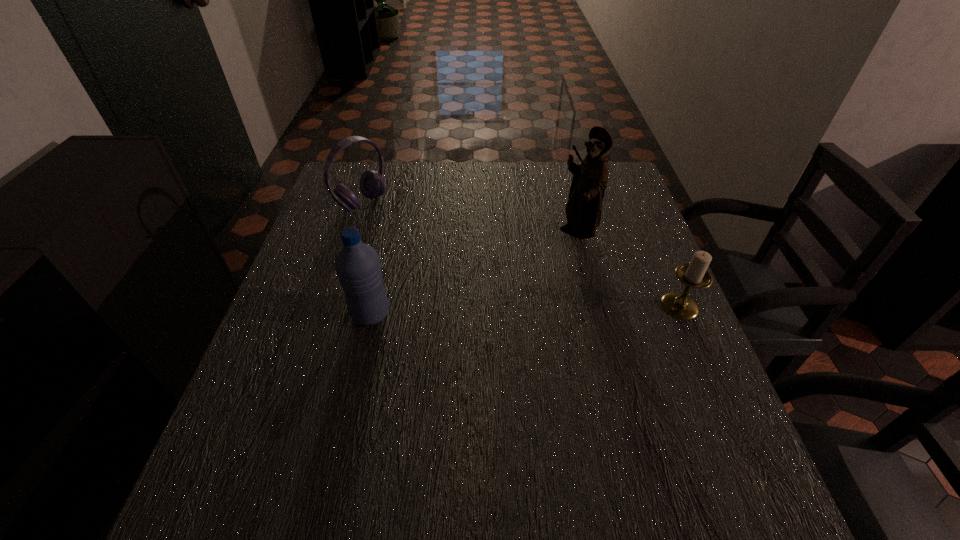
Where is `object present at the far left corner`? This screenshot has width=960, height=540. object present at the far left corner is located at coordinates (372, 183).

Where is `vacant space at the far edge`? vacant space at the far edge is located at coordinates (392, 165).

Identify the location of free spot at the near edge of the desktop. (324, 446).

Image resolution: width=960 pixels, height=540 pixels. In the image, there is a desktop. What are the coordinates of `vacant space at the left edge` in the screenshot? It's located at (330, 338).

At what (x,y) coordinates should I click in order to perform the action: click on vacant area at the right edge of the desktop. Please return your answer as a coordinate pair (x, y). This screenshot has width=960, height=540. Looking at the image, I should click on (612, 274).

In the image, there is a desktop. Where is `blank space at the near left corner`? The height and width of the screenshot is (540, 960). blank space at the near left corner is located at coordinates (305, 441).

Identify the location of vacant space at the far right corner. The image size is (960, 540). (612, 185).

Where is `free spot between the candle holder and the water bottle`? The height and width of the screenshot is (540, 960). free spot between the candle holder and the water bottle is located at coordinates (525, 310).

Find the location of a particular element. The image size is (960, 540). vacant space in between the third object from left to right and the shortest object is located at coordinates (628, 269).

Image resolution: width=960 pixels, height=540 pixels. Find the location of `empty space between the second tallest object and the tallest object`. empty space between the second tallest object and the tallest object is located at coordinates (473, 274).